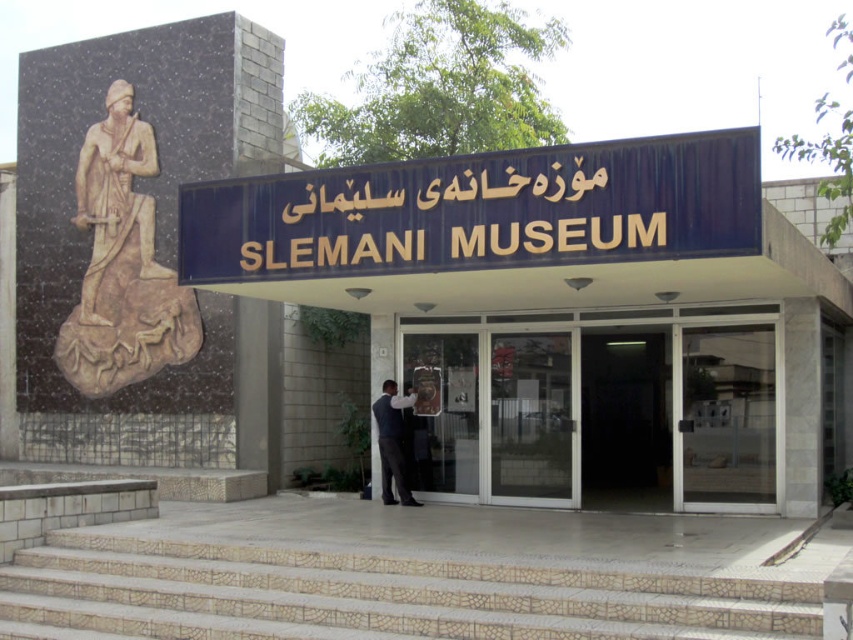
Question: Which point is closer to the camera taking this photo?

Choices:
 (A) (393, 460)
 (B) (178, 211)
 (C) (125, 381)
 (D) (532, 348)

Answer: (B)

Question: Does transparent glass doors at center appear on the right side of blue metallic sign at center?

Choices:
 (A) no
 (B) yes

Answer: (B)

Question: Can you confirm if blue metallic sign at center is wider than beige stone statue at left?

Choices:
 (A) yes
 (B) no

Answer: (B)

Question: Which is farther from the beige stone statue at left?

Choices:
 (A) white mosaic stairs at center
 (B) dark blue suit at center

Answer: (A)

Question: Is beige stone statue at left below dark blue suit at center?

Choices:
 (A) no
 (B) yes

Answer: (A)

Question: Which point appears closest to the camera in this image?

Choices:
 (A) (457, 564)
 (B) (434, 346)

Answer: (A)